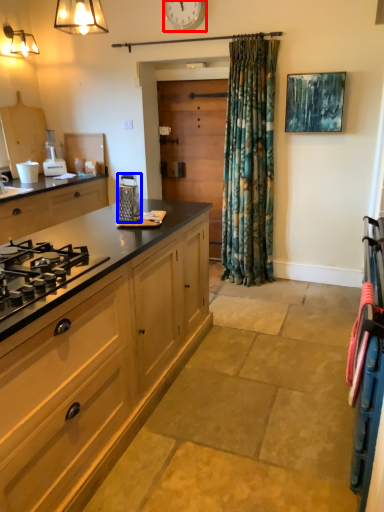
Question: Which object appears closest to the camera in this image, clock (highlighted by a red box) or kitchen appliance (highlighted by a blue box)?

Choices:
 (A) clock
 (B) kitchen appliance

Answer: (B)